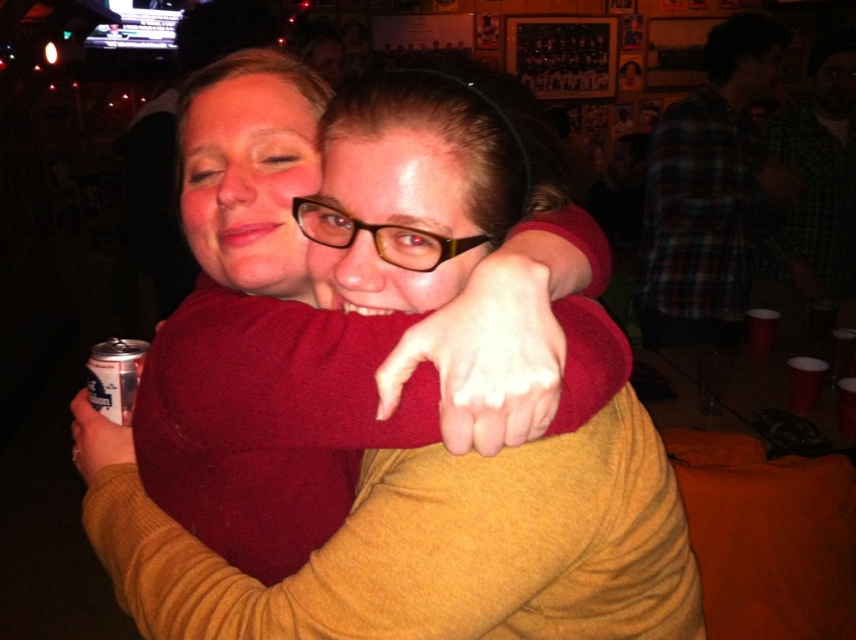
Question: Is matte red sweater at center further to camera compared to silver metallic can at lower left?

Choices:
 (A) no
 (B) yes

Answer: (A)

Question: Is matte red sweater at center below silver metallic can at lower left?

Choices:
 (A) yes
 (B) no

Answer: (A)

Question: Is matte red sweater at center below silver metallic can at lower left?

Choices:
 (A) yes
 (B) no

Answer: (A)

Question: Which point is farther to the camera?

Choices:
 (A) matte red sweater at center
 (B) silver metallic can at lower left

Answer: (B)

Question: Among these points, which one is nearest to the camera?

Choices:
 (A) (111, 394)
 (B) (354, 243)

Answer: (B)

Question: Which of the following is the farthest from the observer?

Choices:
 (A) silver metallic can at lower left
 (B) matte red sweater at center

Answer: (A)